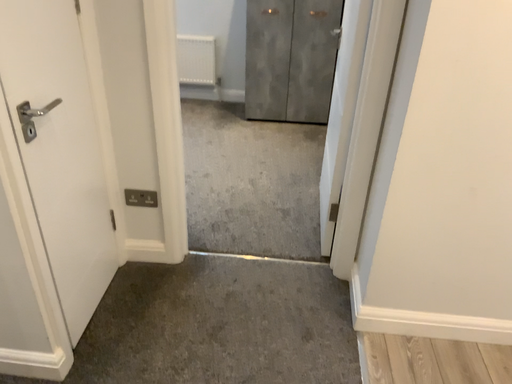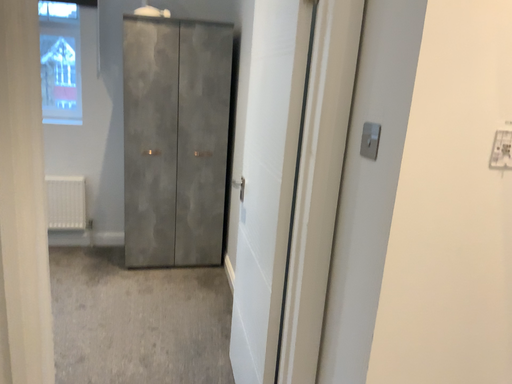
Question: How did the camera likely rotate when shooting the video?

Choices:
 (A) rotated upward
 (B) rotated downward

Answer: (A)